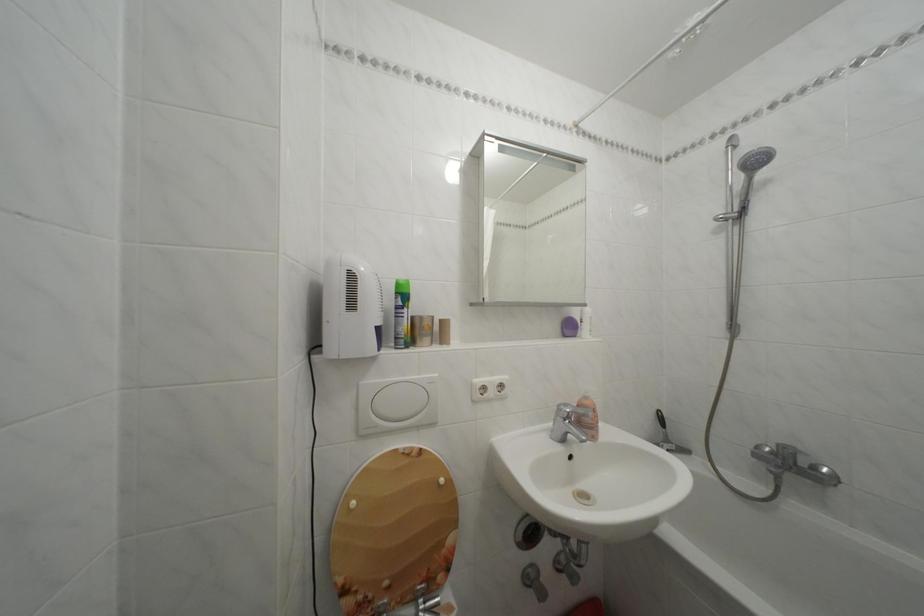
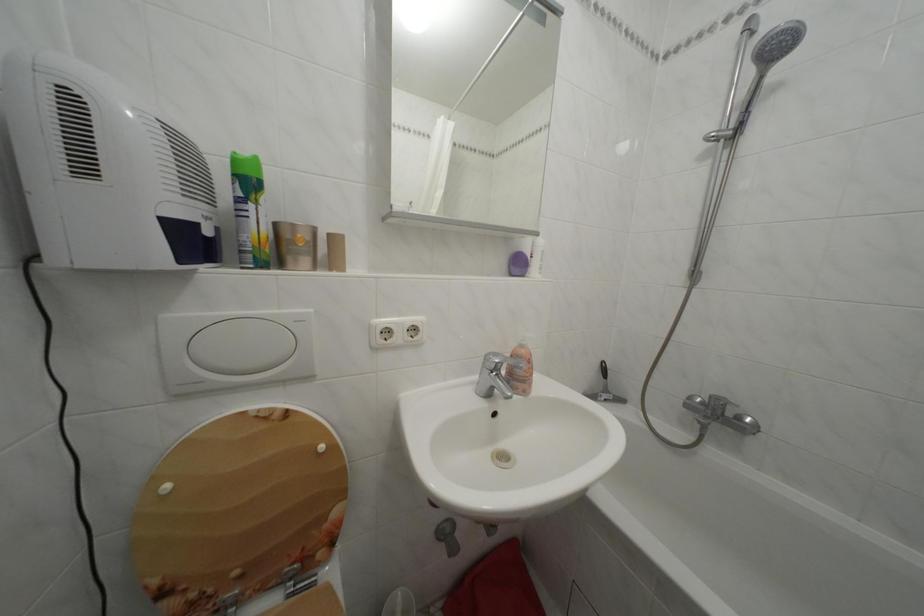
Where in the second image is the point corresponding to the point at 371,389 from the first image?

(174, 323)